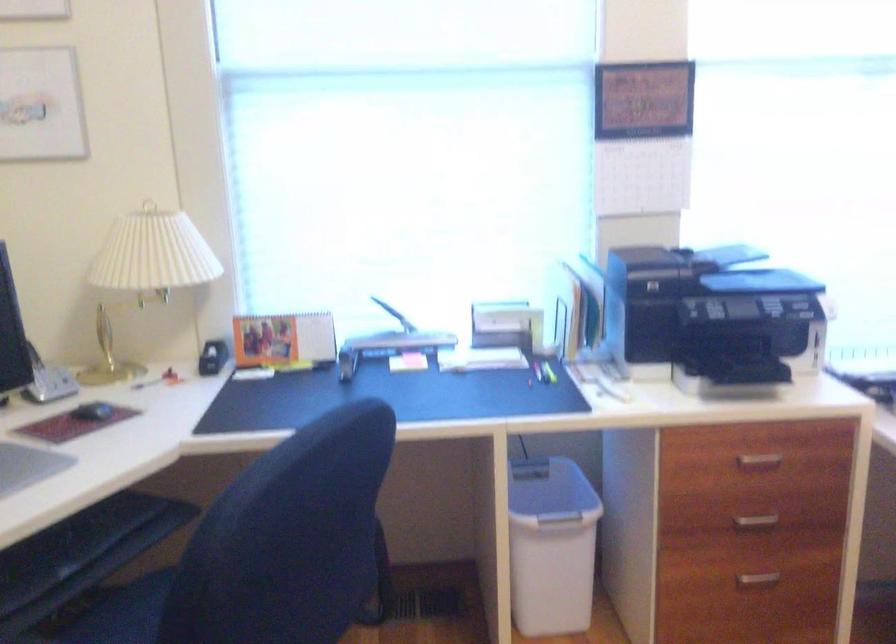
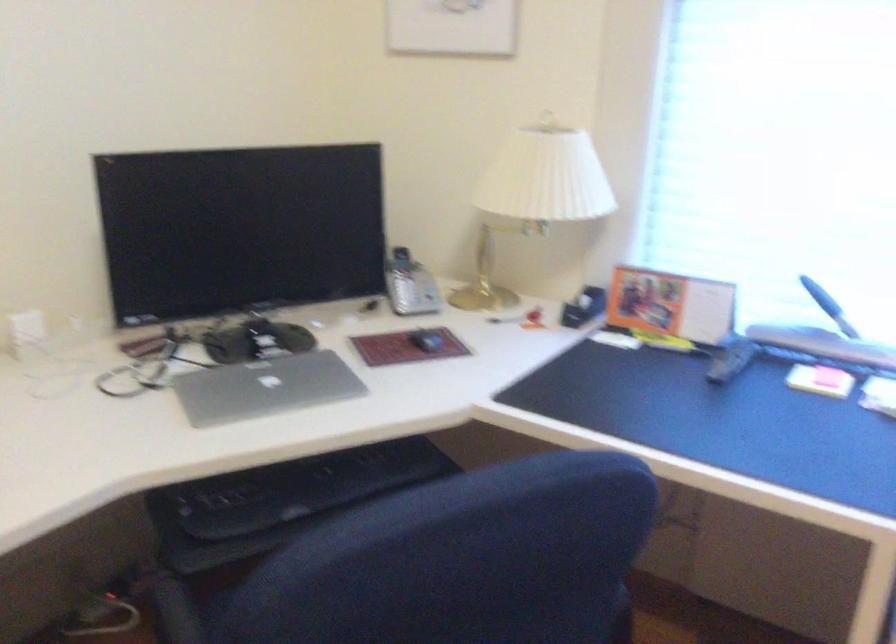
Find the pixel in the second image that matches (287,337) in the first image.

(670, 305)